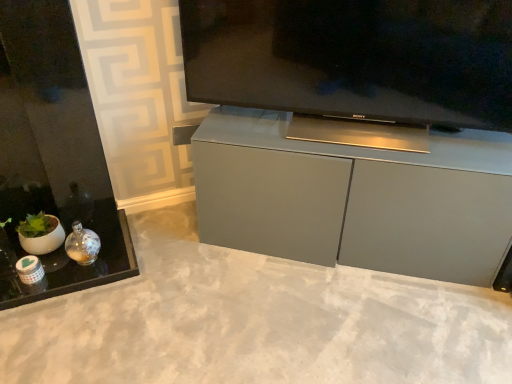
Find the location of a particular element. free space that is to the left of matte gray cabinet at center is located at coordinates (172, 288).